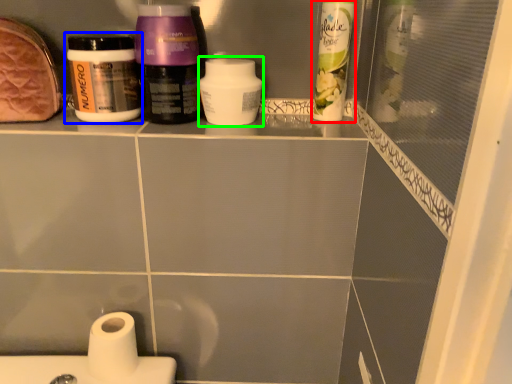
Question: Based on their relative distances, which object is farther from cleaning product (highlighted by a red box)? Choose from bottle (highlighted by a blue box) and cleaning product (highlighted by a green box).

Choices:
 (A) bottle
 (B) cleaning product

Answer: (A)